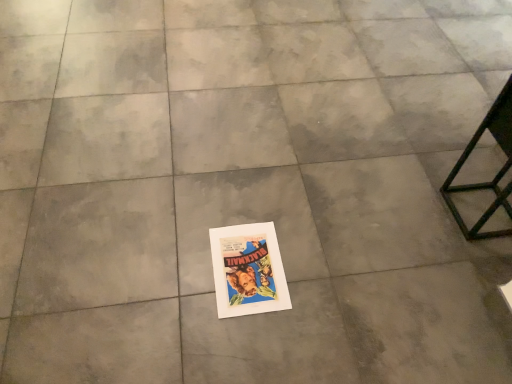
Question: From a real-world perspective, is vibrant paper poster at center physically located above or below metallic black table at right?

Choices:
 (A) above
 (B) below

Answer: (B)

Question: From their relative heights in the image, would you say vibrant paper poster at center is taller or shorter than metallic black table at right?

Choices:
 (A) tall
 (B) short

Answer: (B)

Question: Would you say vibrant paper poster at center is inside or outside metallic black table at right?

Choices:
 (A) outside
 (B) inside

Answer: (A)

Question: Is metallic black table at right wider or thinner than vibrant paper poster at center?

Choices:
 (A) thin
 (B) wide

Answer: (A)

Question: From the image's perspective, is metallic black table at right above or below vibrant paper poster at center?

Choices:
 (A) above
 (B) below

Answer: (A)

Question: In terms of height, does metallic black table at right look taller or shorter compared to vibrant paper poster at center?

Choices:
 (A) tall
 (B) short

Answer: (A)

Question: Considering their positions, is metallic black table at right located in front of or behind vibrant paper poster at center?

Choices:
 (A) behind
 (B) front

Answer: (B)